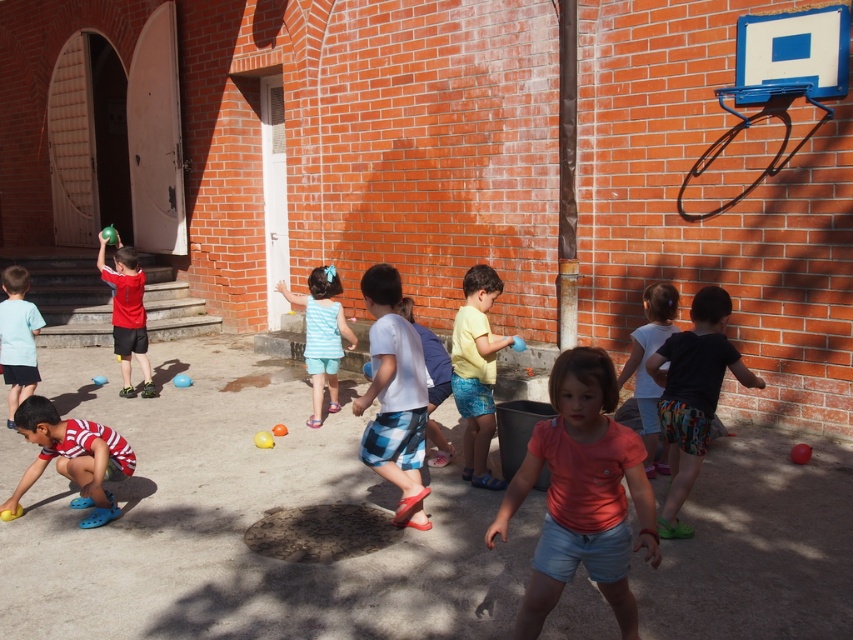
Is pink matte shirt at center smaller than striped cotton shorts at center?

Yes.

How far apart are pink matte shirt at center and striped cotton shorts at center?

pink matte shirt at center and striped cotton shorts at center are 3.69 meters apart from each other.

Does point (659, 536) lie behind point (320, 284)?

No, (659, 536) is closer to viewer.

Find the location of a particular element. The image size is (853, 640). pink matte shirt at center is located at coordinates (582, 493).

How far apart are light blue t-shirt at left and white plaid shorts at center?

The distance of light blue t-shirt at left from white plaid shorts at center is 3.73 meters.

Is light blue t-shirt at left thinner than white plaid shorts at center?

No.

Where is `light blue t-shirt at left`? light blue t-shirt at left is located at coordinates (16, 339).

Where is `light blue t-shirt at left`? light blue t-shirt at left is located at coordinates (16, 339).

Who is taller, blue plaid shorts at center or striped cotton shorts at center?

blue plaid shorts at center

Does blue plaid shorts at center lie behind striped cotton shorts at center?

No, blue plaid shorts at center is closer to the viewer.

Describe the element at coordinates (393, 396) in the screenshot. This screenshot has height=640, width=853. I see `blue plaid shorts at center` at that location.

This screenshot has width=853, height=640. What are the coordinates of `blue plaid shorts at center` in the screenshot? It's located at (393, 396).